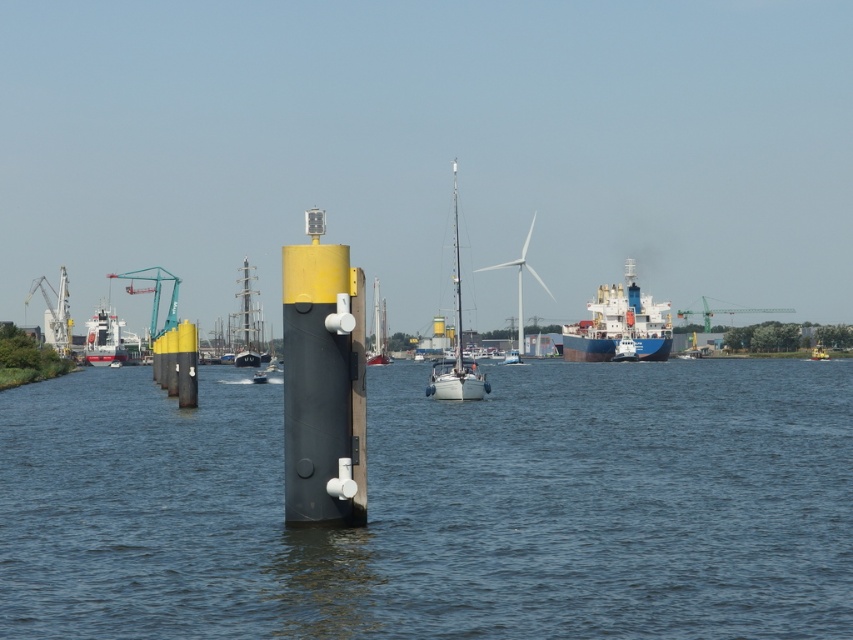
Question: Which of the following is the closest to the observer?

Choices:
 (A) white glossy ship at left
 (B) shiny silver sailboat at center
 (C) yellow matte buoy at center
 (D) black matte post at center

Answer: (D)

Question: Which object is the closest to the yellow matte buoy at center?

Choices:
 (A) white glossy ship at left
 (B) black matte post at center

Answer: (A)

Question: Is shiny silver sailboat at center in front of green metallic crane at upper right?

Choices:
 (A) yes
 (B) no

Answer: (A)

Question: Does black matte post at center appear under green metallic crane at upper right?

Choices:
 (A) yes
 (B) no

Answer: (A)

Question: Which object is farther from the camera taking this photo?

Choices:
 (A) yellow matte buoy at center
 (B) blue matte cargo ship at center

Answer: (A)

Question: Can you confirm if shiny silver sailboat at center is positioned to the left of red sailboat at center?

Choices:
 (A) no
 (B) yes

Answer: (B)